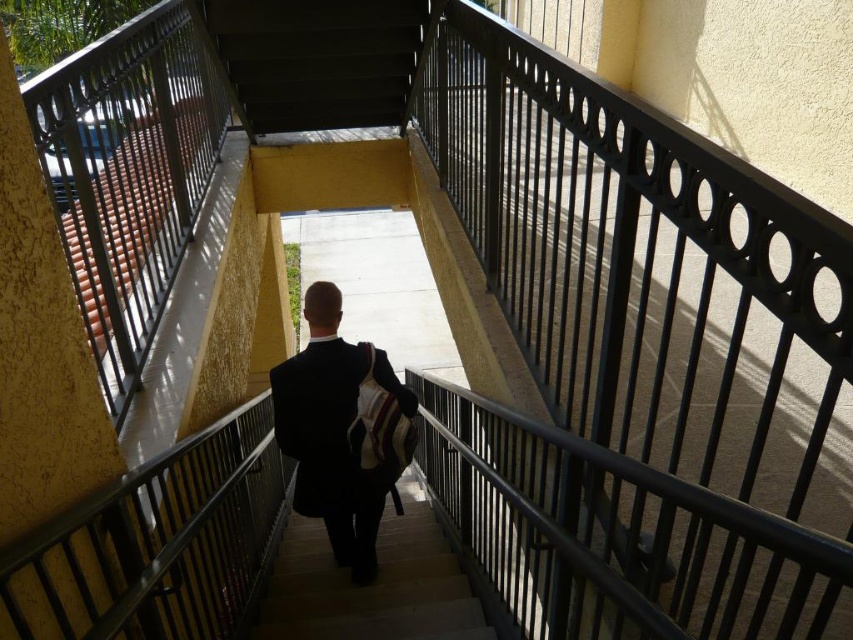
Question: Among these objects, which one is nearest to the camera?

Choices:
 (A) dark suit at center
 (B) wooden stairs at center

Answer: (A)

Question: Does dark gray metal stairwell at center lie behind wooden stairs at center?

Choices:
 (A) yes
 (B) no

Answer: (A)

Question: Which is nearer to the dark suit at center?

Choices:
 (A) dark gray metal stairwell at center
 (B) wooden stairs at center

Answer: (B)

Question: Is dark suit at center smaller than wooden stairs at center?

Choices:
 (A) no
 (B) yes

Answer: (B)

Question: Which object is the closest to the dark suit at center?

Choices:
 (A) dark gray metal stairwell at center
 (B) wooden stairs at center

Answer: (B)

Question: Does dark gray metal stairwell at center have a larger size compared to dark suit at center?

Choices:
 (A) yes
 (B) no

Answer: (B)